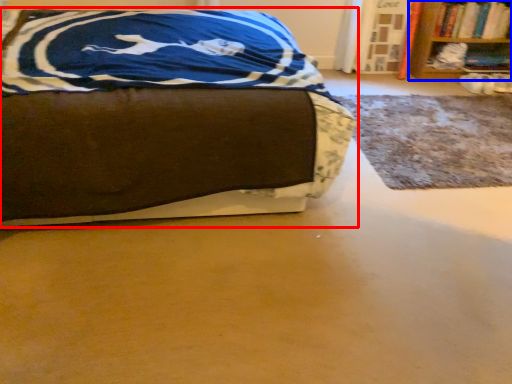
Question: Which point is further to the camera, bed (highlighted by a red box) or bookcase (highlighted by a blue box)?

Choices:
 (A) bed
 (B) bookcase

Answer: (B)